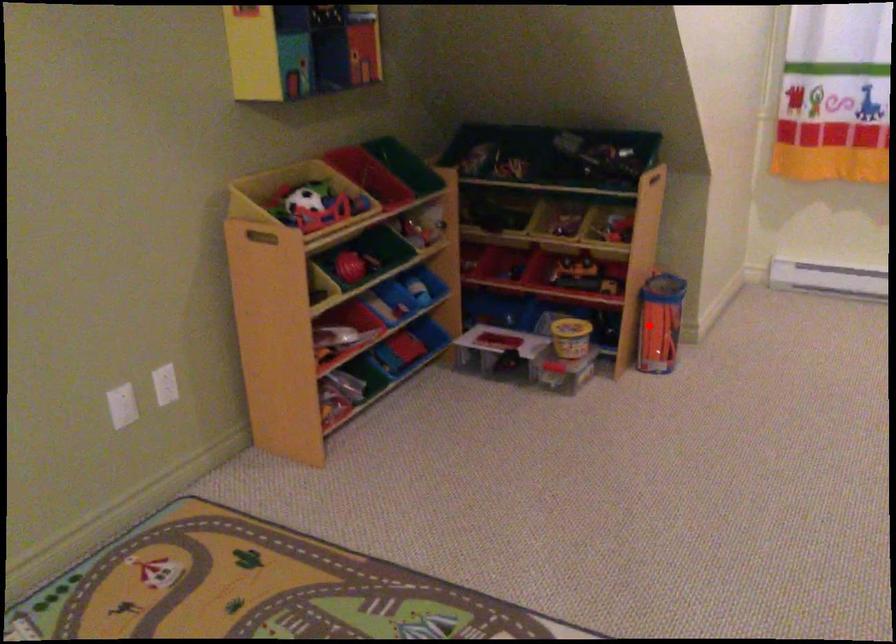
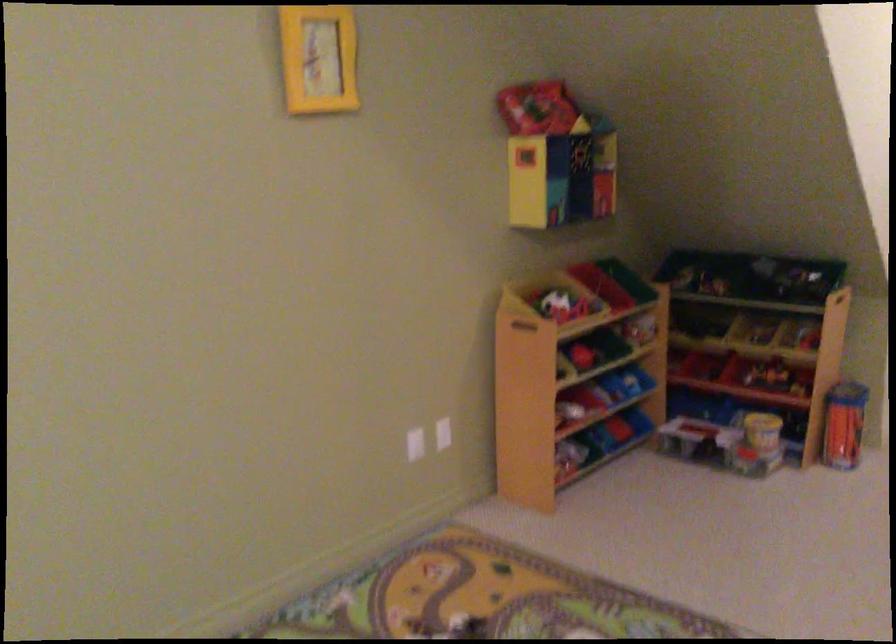
Question: I am providing you with two images of the same scene from different viewpoints. In image1, a red point is highlighted. Considering the same 3D point in image2, which of the following is correct?

Choices:
 (A) It is closer
 (B) It is farther

Answer: (B)